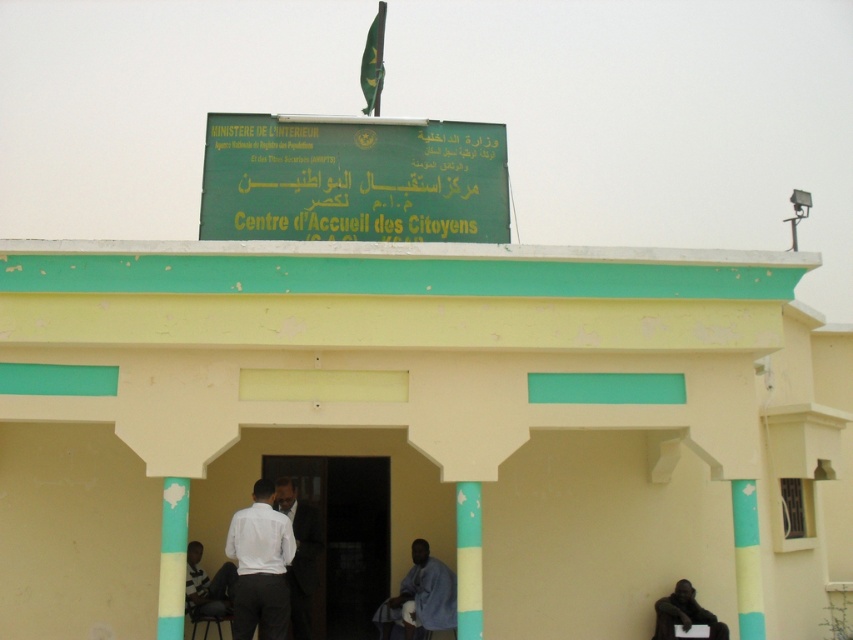
Who is more forward, (247, 580) or (657, 637)?

Positioned in front is point (247, 580).

Is white matte shirt at center below dark skin statue at lower right?

Incorrect, white matte shirt at center is not positioned below dark skin statue at lower right.

Between point (247, 515) and point (669, 609), which one is positioned in front?

Point (247, 515) is in front.

Where is `white matte shirt at center`? white matte shirt at center is located at coordinates (260, 564).

Does point (372, 218) come closer to viewer compared to point (281, 492)?

Yes, point (372, 218) is closer to viewer.

Which is above, green matte signboard at center or dark suit at center?

green matte signboard at center

Does point (343, 152) come behind point (300, 582)?

No, (343, 152) is closer to viewer.

The image size is (853, 640). In order to click on green matte signboard at center in this screenshot , I will do `click(352, 180)`.

Locate an element on the screen. The height and width of the screenshot is (640, 853). white matte shirt at center is located at coordinates (260, 564).

Can you confirm if white matte shirt at center is positioned to the right of yellow painted pillar at center?

No, white matte shirt at center is not to the right of yellow painted pillar at center.

At what (x,y) coordinates should I click in order to perform the action: click on white matte shirt at center. Please return your answer as a coordinate pair (x, y). The image size is (853, 640). Looking at the image, I should click on (260, 564).

This screenshot has width=853, height=640. Identify the location of white matte shirt at center. (260, 564).